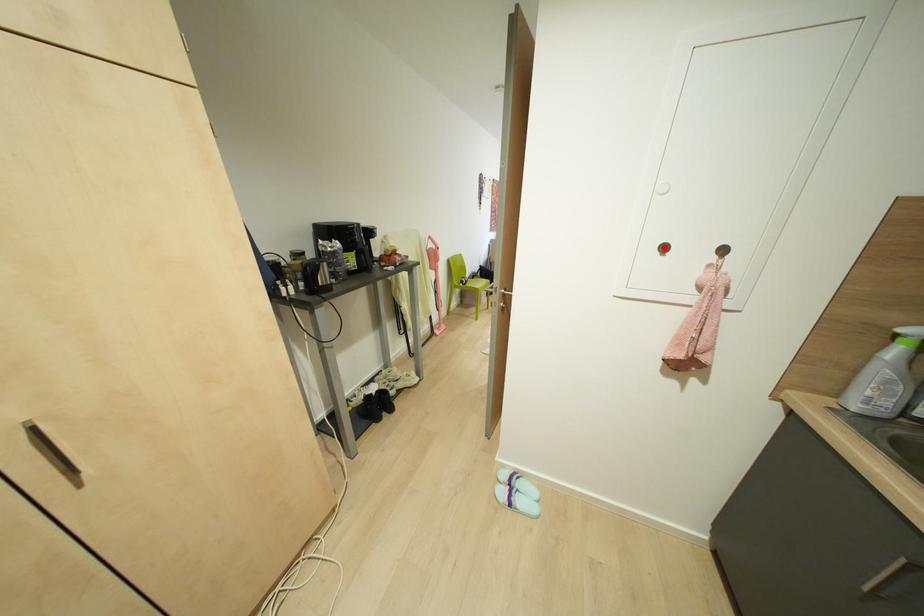
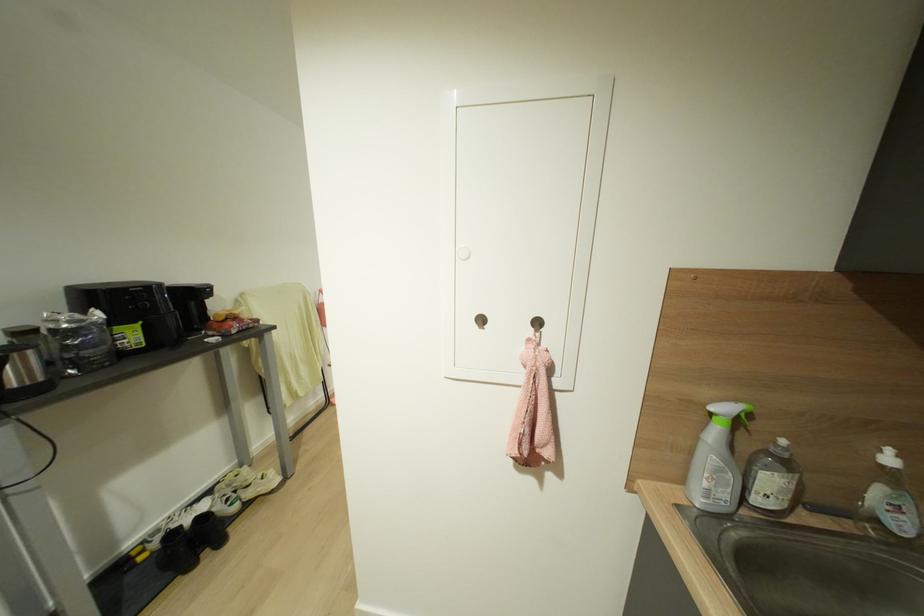
The point at the highlighted location is marked in the first image. Where is the corresponding point in the second image?

(480, 320)